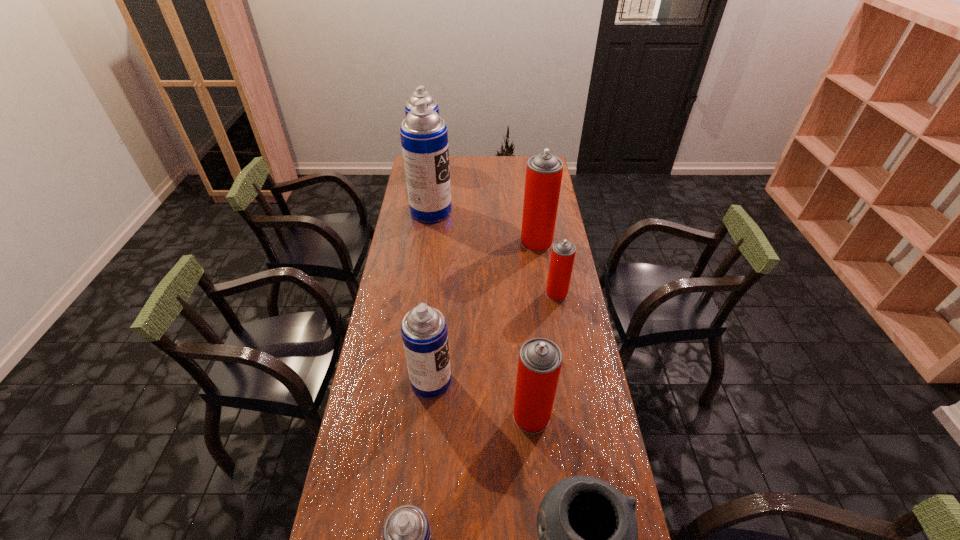
Find the location of a particular element. the biggest blue aerosol can is located at coordinates (424, 135).

Image resolution: width=960 pixels, height=540 pixels. Identify the location of the tallest object. (424, 135).

Where is `the farthest aerosol can`? the farthest aerosol can is located at coordinates (420, 93).

Image resolution: width=960 pixels, height=540 pixels. What are the coordinates of `the third smallest blue aerosol can` in the screenshot? It's located at (420, 93).

Identify the location of the fifth nearest aerosol can. (544, 171).

The image size is (960, 540). I want to click on the farthest red aerosol can, so click(x=544, y=171).

What are the coordinates of `the sixth farthest aerosol can` in the screenshot? It's located at (540, 360).

Locate an element on the screen. This screenshot has height=540, width=960. the nearest red aerosol can is located at coordinates (540, 360).

Where is `the fourth nearest object`? The width and height of the screenshot is (960, 540). the fourth nearest object is located at coordinates (424, 332).

At what (x,y) coordinates should I click in order to perform the action: click on the second smallest blue aerosol can. Please return your answer as a coordinate pair (x, y). The height and width of the screenshot is (540, 960). Looking at the image, I should click on (424, 332).